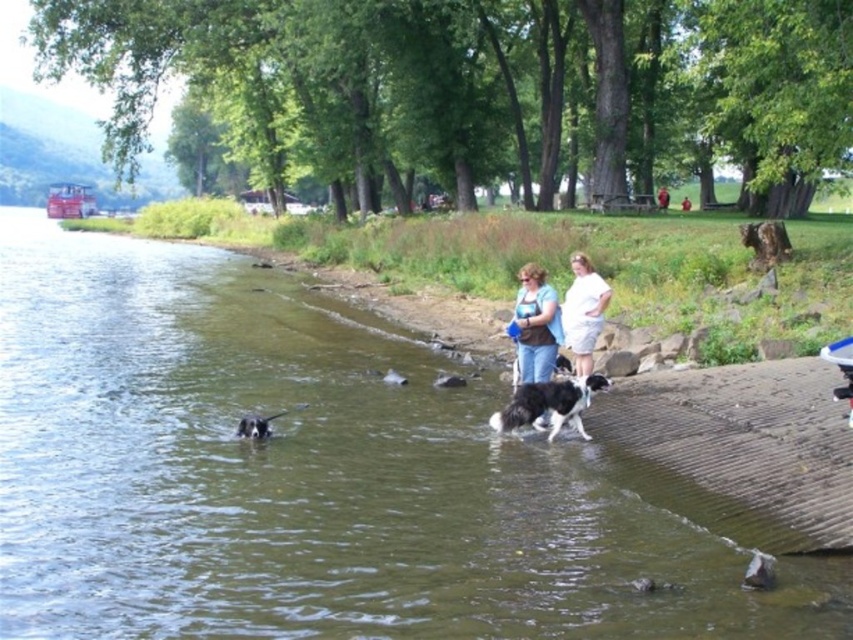
Consider the image. Is black and white fur dog at center smaller than black and white fur at center?

Actually, black and white fur dog at center might be larger than black and white fur at center.

Does black and white fur dog at center appear under black and white fur at center?

Indeed, black and white fur dog at center is positioned under black and white fur at center.

Does point (508, 428) come in front of point (556, 360)?

Yes.

Find the location of a particular element. This screenshot has height=640, width=853. black and white fur dog at center is located at coordinates (549, 404).

Can you confirm if blue jeans at center is shorter than white cotton shirt at center?

Yes, blue jeans at center is shorter than white cotton shirt at center.

Who is more forward, (538, 332) or (570, 340)?

Point (538, 332) is more forward.

Between point (538, 276) and point (573, 256), which one is positioned in front?

Positioned in front is point (538, 276).

At what (x,y) coordinates should I click in order to perform the action: click on blue jeans at center. Please return your answer as a coordinate pair (x, y). Looking at the image, I should click on (535, 324).

Does black and white fur dog at center have a greater width compared to white cotton shirt at center?

Yes.

Which is below, black and white fur dog at center or white cotton shirt at center?

black and white fur dog at center is below.

Which is in front, point (515, 419) or point (576, 321)?

Point (515, 419) is in front.

I want to click on black and white fur dog at center, so click(549, 404).